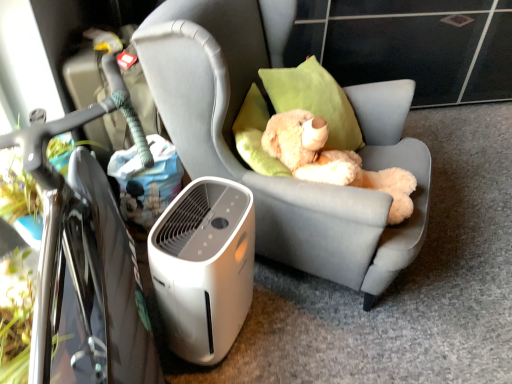
Question: Is the depth of fluffy beige teddy bear at center greater than that of white plastic air purifier at lower left?

Choices:
 (A) no
 (B) yes

Answer: (B)

Question: Is fluffy beige teddy bear at center directly adjacent to white plastic air purifier at lower left?

Choices:
 (A) no
 (B) yes

Answer: (A)

Question: Could you tell me if fluffy beige teddy bear at center is turned towards white plastic air purifier at lower left?

Choices:
 (A) yes
 (B) no

Answer: (B)

Question: Can you confirm if fluffy beige teddy bear at center is positioned to the right of white plastic air purifier at lower left?

Choices:
 (A) no
 (B) yes

Answer: (B)

Question: Is fluffy beige teddy bear at center positioned before white plastic air purifier at lower left?

Choices:
 (A) no
 (B) yes

Answer: (A)

Question: From their relative heights in the image, would you say fluffy beige teddy bear at center is taller or shorter than white plastic air purifier at lower left?

Choices:
 (A) tall
 (B) short

Answer: (B)

Question: Visually, is fluffy beige teddy bear at center positioned to the left or to the right of white plastic air purifier at lower left?

Choices:
 (A) right
 (B) left

Answer: (A)

Question: Considering their positions, is fluffy beige teddy bear at center located in front of or behind white plastic air purifier at lower left?

Choices:
 (A) behind
 (B) front

Answer: (A)

Question: Is fluffy beige teddy bear at center wider or thinner than white plastic air purifier at lower left?

Choices:
 (A) wide
 (B) thin

Answer: (A)

Question: From a real-world perspective, relative to white plastic air purifier at lower left, is light gray fabric chair at center vertically above or below?

Choices:
 (A) below
 (B) above

Answer: (B)

Question: From their relative heights in the image, would you say light gray fabric chair at center is taller or shorter than white plastic air purifier at lower left?

Choices:
 (A) short
 (B) tall

Answer: (B)

Question: Is light gray fabric chair at center wider or thinner than white plastic air purifier at lower left?

Choices:
 (A) thin
 (B) wide

Answer: (B)

Question: Is point (234, 69) positioned closer to the camera than point (204, 233)?

Choices:
 (A) farther
 (B) closer

Answer: (A)

Question: Is point (41, 261) closer or farther from the camera than point (234, 248)?

Choices:
 (A) farther
 (B) closer

Answer: (B)

Question: In terms of width, does black glossy bicycle at left look wider or thinner when compared to white plastic air purifier at lower left?

Choices:
 (A) wide
 (B) thin

Answer: (A)